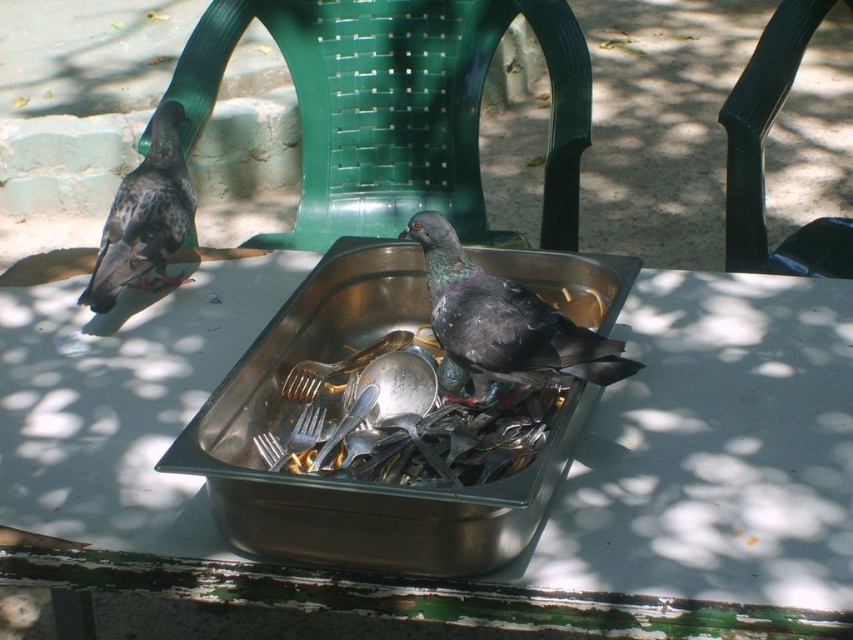
You are a photographer setting up a shot of the green plastic chair at upper center and the shiny dark gray bird at center. To ensure both are in frame, should you adjust your camera to the left or right? Explain your reasoning based on their positions.

The green plastic chair at upper center is to the left of the shiny dark gray bird at center. Therefore, to include both in the frame, you should adjust your camera to the right to capture the leftmost object and the rightmost object within the same shot.

You are a photographer trying to capture a clear shot of the shiny dark gray bird at center. However, the green plastic chair at upper center is blocking your view. Can you move the chair to the side to get a better angle?

The green plastic chair at upper center is above the shiny dark gray bird at center, so moving the chair could allow you to see the bird more clearly.

You are a photographer trying to capture a clear shot of the green plastic chair at upper center and the brushed metal spoon at center. However, you notice that the spoon is partially blocking the view of the chair. Is the spoon actually in front of or behind the chair in the scene?

The brushed metal spoon at center is behind green plastic chair at upper center, so the spoon is not blocking the view of the chair. Therefore, you can capture a clear shot of the green plastic chair at upper center without any obstruction from the spoon.